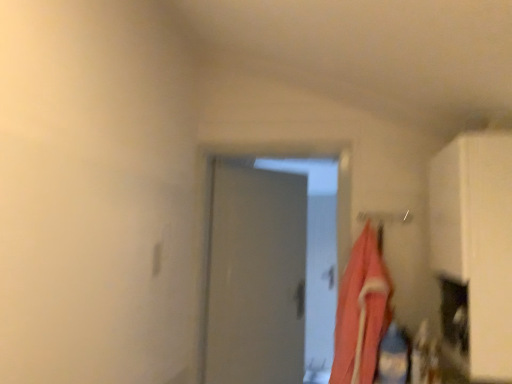
Question: Do you think matte pink fabric at right is within white matte cabinet at right, or outside of it?

Choices:
 (A) outside
 (B) inside

Answer: (A)

Question: From the image's perspective, is matte pink fabric at right positioned above or below white matte cabinet at right?

Choices:
 (A) below
 (B) above

Answer: (A)

Question: Looking at the image, does matte pink fabric at right seem bigger or smaller compared to white matte cabinet at right?

Choices:
 (A) big
 (B) small

Answer: (B)

Question: Is white matte cabinet at right in front of or behind matte pink fabric at right in the image?

Choices:
 (A) behind
 (B) front

Answer: (B)

Question: Considering the positions of white matte cabinet at right and matte pink fabric at right in the image, is white matte cabinet at right wider or thinner than matte pink fabric at right?

Choices:
 (A) wide
 (B) thin

Answer: (A)

Question: From the image's perspective, is white matte cabinet at right above or below matte pink fabric at right?

Choices:
 (A) above
 (B) below

Answer: (A)

Question: Which is correct: white matte cabinet at right is inside matte pink fabric at right, or outside of it?

Choices:
 (A) inside
 (B) outside

Answer: (B)